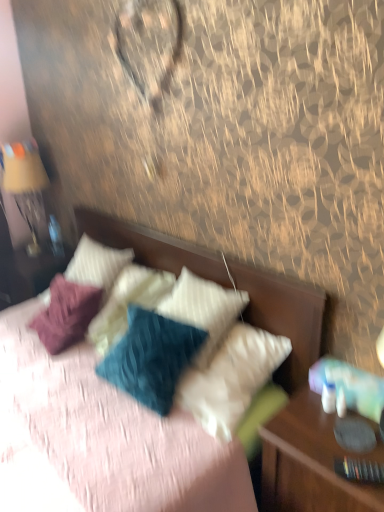
Find the location of a particular element. This screenshot has width=384, height=512. vacant space situated above wooden nightstand at right (from a real-world perspective) is located at coordinates (337, 439).